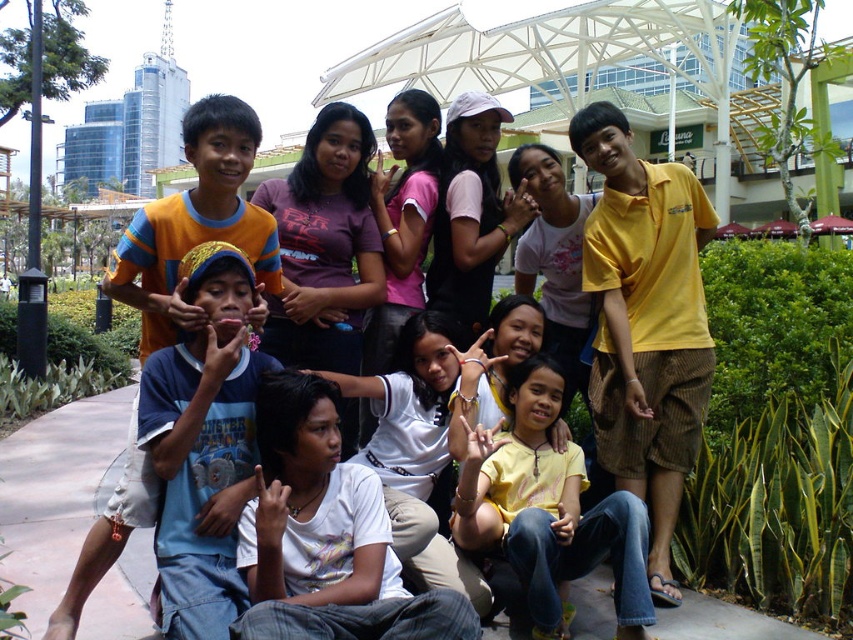
You are organizing a photo shoot and need to arrange the children so that the yellow cotton polo shirt at center and the yellow matte shirt at center are visible to the camera. Since the camera is at eye level with the taller child, which child should you ask to stand slightly behind to avoid blocking the view of the other?

The yellow cotton polo shirt at center is shorter than the yellow matte shirt at center, so you should position the child wearing the yellow cotton polo shirt at center to stand slightly behind to ensure their view isn

You are a photographer trying to capture a group shot of the children in the park. You notice the yellow cotton polo shirt at center and the blue cotton shirt at center. Which child should you ask to move slightly to the right to ensure both shirts are visible in the frame?

The yellow cotton polo shirt at center has a lesser width compared to blue cotton shirt at center, so you should ask the child wearing the blue cotton shirt at center to move slightly to the right to accommodate its wider size.

You are a photographer trying to adjust the focus of your camera to capture the yellow cotton polo shirt at center and the yellow matte shirt at center. Which one should you focus on first if you want to ensure the topmost layer is sharp?

The yellow cotton polo shirt at center is positioned over the yellow matte shirt at center, so you should focus on the yellow cotton polo shirt at center first to ensure the topmost layer is sharp.